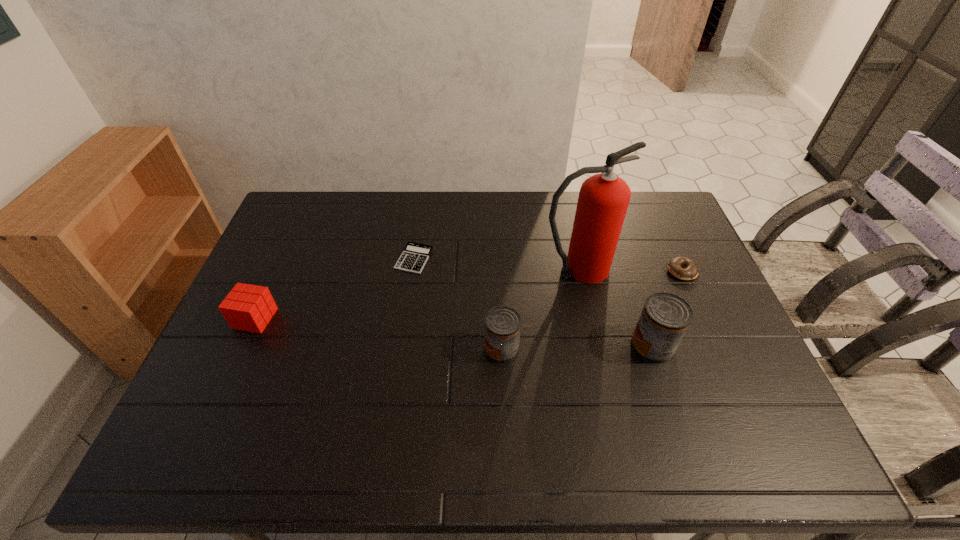
You are a GUI agent. You are given a task and a screenshot of the screen. Output one action in this format:
    pyautogui.click(x=<x>, y=<y>)
    Task: Click on the tallest object
    
    Given the screenshot: What is the action you would take?
    pyautogui.click(x=603, y=200)

This screenshot has width=960, height=540. What are the coordinates of `vacant region located on the left of the shorter can` in the screenshot? It's located at (405, 348).

At what (x,y) coordinates should I click in order to perform the action: click on free location located on the back of the second tallest object. Please return your answer as a coordinate pair (x, y). Looking at the image, I should click on (620, 248).

The height and width of the screenshot is (540, 960). In order to click on blank space located 0.190m on the right of the calculator in this screenshot , I will do `click(492, 259)`.

The image size is (960, 540). Find the location of `vacant space located on the right of the leftmost object`. vacant space located on the right of the leftmost object is located at coordinates (392, 319).

The width and height of the screenshot is (960, 540). What are the coordinates of `free space located on the front of the fifth tallest object` in the screenshot? It's located at (715, 348).

Identify the location of free space located on the handle side of the fire extinguisher. The width and height of the screenshot is (960, 540). [x=685, y=269].

What are the coordinates of `object at the left edge` in the screenshot? It's located at (247, 307).

Find the location of a particular element. The image size is (960, 540). object that is at the right edge is located at coordinates (675, 265).

Image resolution: width=960 pixels, height=540 pixels. I want to click on free space at the far edge of the desktop, so click(367, 214).